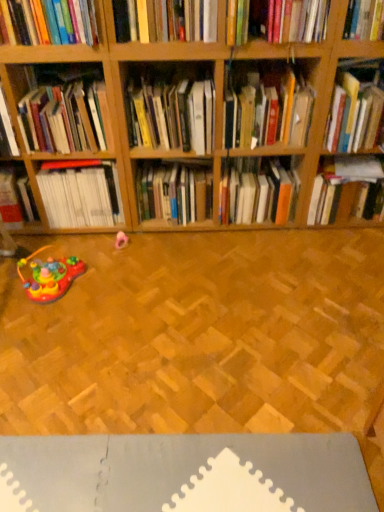
This screenshot has height=512, width=384. Identify the location of unoccupied area in front of rubberized plastic toy at lower left, the 1th toy when ordered from bottom to top. (49, 330).